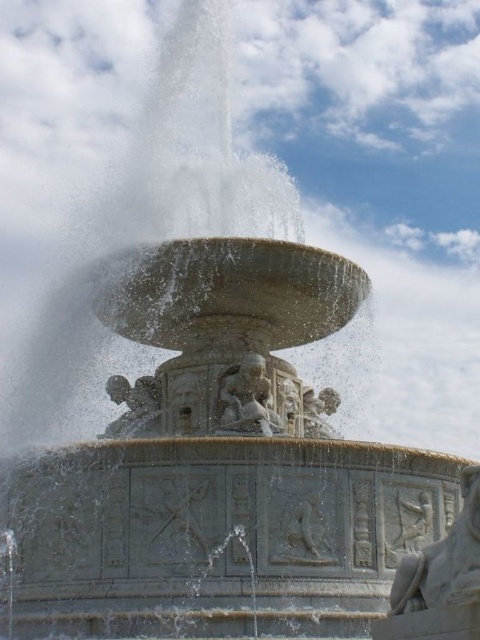
You are an architect inspecting the fountain. You notice the gray stone relief at center and the polished stone cherub at center. Which one has a greater height?

The gray stone relief at center is taller than the polished stone cherub at center.